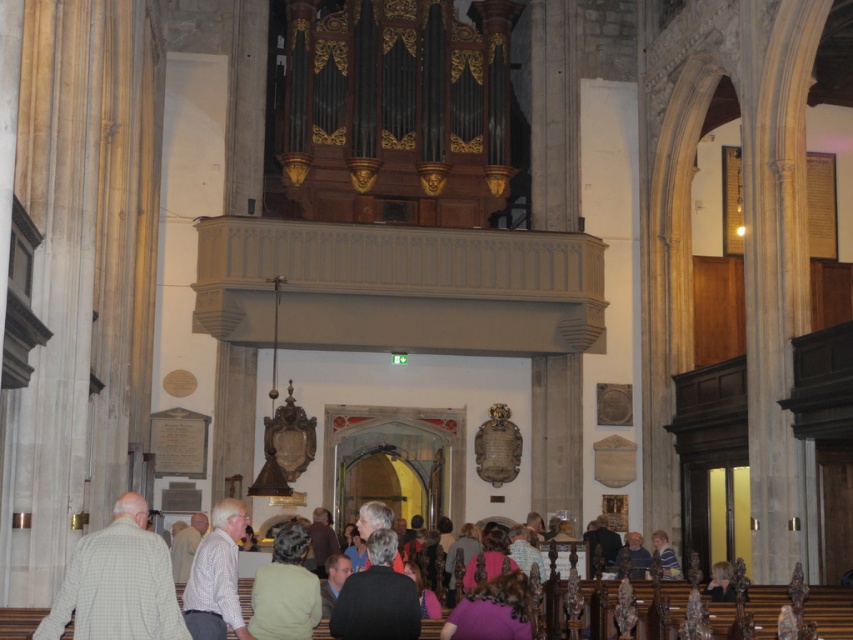
From the picture: You are attending a concert in this cathedral and notice two people in the audience. One is wearing a dark gray sweater at lower center and the other a checkered shirt at center. Which person is sitting closer to the front of the cathedral?

The dark gray sweater at lower center is shorter than the checkered shirt at center, meaning the person in the dark gray sweater at lower center is sitting closer to the front.